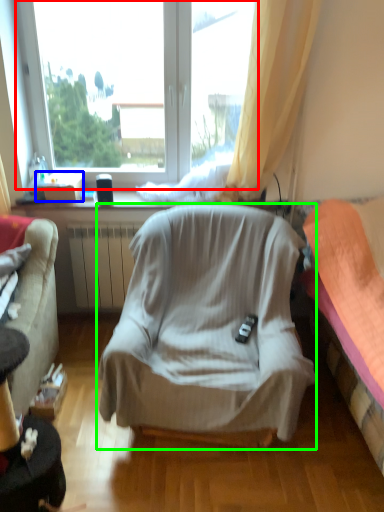
Question: Estimate the real-world distances between objects in this image. Which object is farther from window (highlighted by a red box), box (highlighted by a blue box) or chair (highlighted by a green box)?

Choices:
 (A) box
 (B) chair

Answer: (B)